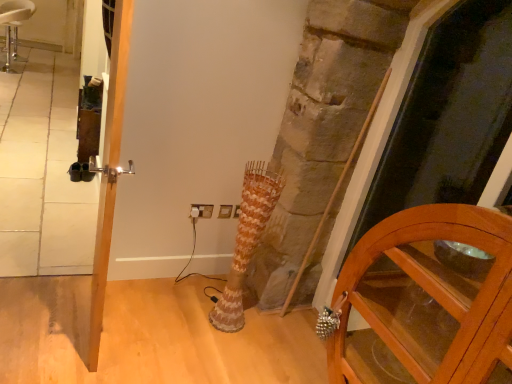
What do you see at coordinates (426, 302) in the screenshot? Image resolution: width=512 pixels, height=384 pixels. I see `wooden cabinet at lower right` at bounding box center [426, 302].

Measure the distance between wooden cabinet at lower right and camera.

wooden cabinet at lower right and camera are 1.08 meters apart from each other.

Where is `polished silver door handle at left`? Image resolution: width=512 pixels, height=384 pixels. polished silver door handle at left is located at coordinates (109, 160).

The width and height of the screenshot is (512, 384). What do you see at coordinates (201, 210) in the screenshot?
I see `white plastic electric outlet at center` at bounding box center [201, 210].

This screenshot has height=384, width=512. Describe the element at coordinates (12, 25) in the screenshot. I see `white leather stool at upper left` at that location.

Find the location of a particular element. This screenshot has width=512, height=384. wooden cabinet at lower right is located at coordinates (426, 302).

Can you confirm if white leather stool at upper left is wider than wooden cabinet at lower right?

Correct, the width of white leather stool at upper left exceeds that of wooden cabinet at lower right.

Are white leather stool at upper left and wooden cabinet at lower right beside each other?

No, white leather stool at upper left is not making contact with wooden cabinet at lower right.

Considering the relative sizes of white leather stool at upper left and wooden cabinet at lower right in the image provided, is white leather stool at upper left taller than wooden cabinet at lower right?

In fact, white leather stool at upper left may be shorter than wooden cabinet at lower right.

You are a GUI agent. You are given a task and a screenshot of the screen. Output one action in this format:
    pyautogui.click(x=<x>, y=<y>)
    Task: Click on the cabinetry above the white leather stool at upper left (from a real-world perspective)
    
    Given the screenshot: What is the action you would take?
    pyautogui.click(x=426, y=302)

Is polished silver door handle at left oriented towards wooden cabinet at lower right?

No, polished silver door handle at left does not turn towards wooden cabinet at lower right.

From the image's perspective, is polished silver door handle at left on top of wooden cabinet at lower right?

Indeed, from the image's perspective, polished silver door handle at left is shown above wooden cabinet at lower right.

Considering the relative sizes of polished silver door handle at left and wooden cabinet at lower right in the image provided, is polished silver door handle at left thinner than wooden cabinet at lower right?

Yes, polished silver door handle at left is thinner than wooden cabinet at lower right.

Is polished silver door handle at left bigger than wooden cabinet at lower right?

No, polished silver door handle at left is not bigger than wooden cabinet at lower right.

Considering the points (466, 136) and (104, 159), which point is behind, point (466, 136) or point (104, 159)?

The point (466, 136) is farther from the camera.

Does transparent glass screen door at right come in front of polished silver door handle at left?

Yes, the depth of transparent glass screen door at right is less than that of polished silver door handle at left.

Are transparent glass screen door at right and polished silver door handle at left located far from each other?

Yes, transparent glass screen door at right and polished silver door handle at left are quite far apart.

Consider the image. From a real-world perspective, is polished silver door handle at left located beneath white leather stool at upper left?

No.

How many degrees apart are the facing directions of polished silver door handle at left and white leather stool at upper left?

93.1 degrees.

Which of these two, polished silver door handle at left or white leather stool at upper left, is wider?

With larger width is white leather stool at upper left.

Is polished silver door handle at left aimed at white leather stool at upper left?

No.

Considering the relative sizes of white plastic electric outlet at center and wooden cabinet at lower right in the image provided, is white plastic electric outlet at center thinner than wooden cabinet at lower right?

Indeed, white plastic electric outlet at center has a lesser width compared to wooden cabinet at lower right.

Is white plastic electric outlet at center not near wooden cabinet at lower right?

That's right, there is a large distance between white plastic electric outlet at center and wooden cabinet at lower right.

From the picture: Does white plastic electric outlet at center lie in front of wooden cabinet at lower right?

No, white plastic electric outlet at center is further to the viewer.

Locate an element on the screen. electric outlet behind the wooden cabinet at lower right is located at coordinates (201, 210).

In the scene shown: Who is shorter, white leather stool at upper left or transparent glass screen door at right?

Standing shorter between the two is white leather stool at upper left.

Considering the points (25, 5) and (476, 200), which point is behind, point (25, 5) or point (476, 200)?

The point (25, 5) is more distant.

Is white leather stool at upper left positioned with its back to transparent glass screen door at right?

No, white leather stool at upper left's orientation is not away from transparent glass screen door at right.

Which of these two, white leather stool at upper left or transparent glass screen door at right, is wider?

Wider between the two is white leather stool at upper left.

Would you say transparent glass screen door at right is a long distance from white leather stool at upper left?

transparent glass screen door at right is positioned a significant distance from white leather stool at upper left.

Is transparent glass screen door at right at the left side of white leather stool at upper left?

Incorrect, transparent glass screen door at right is not on the left side of white leather stool at upper left.

From the image's perspective, is transparent glass screen door at right located beneath white leather stool at upper left?

Correct, transparent glass screen door at right appears lower than white leather stool at upper left in the image.

Is transparent glass screen door at right bigger than white leather stool at upper left?

Yes, transparent glass screen door at right is bigger than white leather stool at upper left.

There is a white leather stool at upper left. Where is `cabinetry above it (from a real-world perspective)`? Image resolution: width=512 pixels, height=384 pixels. cabinetry above it (from a real-world perspective) is located at coordinates pos(426,302).

At what (x,y) coordinates should I click in order to perform the action: click on cabinetry in front of the polished silver door handle at left. Please return your answer as a coordinate pair (x, y). The width and height of the screenshot is (512, 384). Looking at the image, I should click on (426, 302).

Looking at the image, which one is located closer to polished silver door handle at left, wooden cabinet at lower right or transparent glass screen door at right?

Among the two, wooden cabinet at lower right is located nearer to polished silver door handle at left.

From the image, which object appears to be nearer to polished silver door handle at left, white plastic electric outlet at center or wooden cabinet at lower right?

Among the two, white plastic electric outlet at center is located nearer to polished silver door handle at left.

Estimate the real-world distances between objects in this image. Which object is closer to polished silver door handle at left, white plastic electric outlet at center or transparent glass screen door at right?

white plastic electric outlet at center.

From the picture: From the image, which object appears to be nearer to transparent glass screen door at right, polished silver door handle at left or white leather stool at upper left?

polished silver door handle at left.

Based on their spatial positions, is white plastic electric outlet at center or white leather stool at upper left closer to polished silver door handle at left?

Based on the image, white plastic electric outlet at center appears to be nearer to polished silver door handle at left.

When comparing their distances from wooden cabinet at lower right, does white leather stool at upper left or transparent glass screen door at right seem further?

Among the two, white leather stool at upper left is located further to wooden cabinet at lower right.

Looking at the image, which one is located further to polished silver door handle at left, white leather stool at upper left or white plastic electric outlet at center?

white leather stool at upper left is positioned further to the anchor polished silver door handle at left.

Considering their positions, is wooden cabinet at lower right positioned further to transparent glass screen door at right than polished silver door handle at left?

polished silver door handle at left lies further to transparent glass screen door at right than the other object.

Where is `door between white leather stool at upper left and transparent glass screen door at right from left to right`? door between white leather stool at upper left and transparent glass screen door at right from left to right is located at coordinates (109, 160).

Image resolution: width=512 pixels, height=384 pixels. Find the location of `electric outlet between white leather stool at upper left and wooden cabinet at lower right from left to right`. electric outlet between white leather stool at upper left and wooden cabinet at lower right from left to right is located at coordinates (201, 210).

Where is `cabinetry located between white leather stool at upper left and transparent glass screen door at right in the left-right direction`? This screenshot has height=384, width=512. cabinetry located between white leather stool at upper left and transparent glass screen door at right in the left-right direction is located at coordinates (426, 302).

Locate an element on the screen. screen door located between wooden cabinet at lower right and white plastic electric outlet at center in the depth direction is located at coordinates (448, 116).